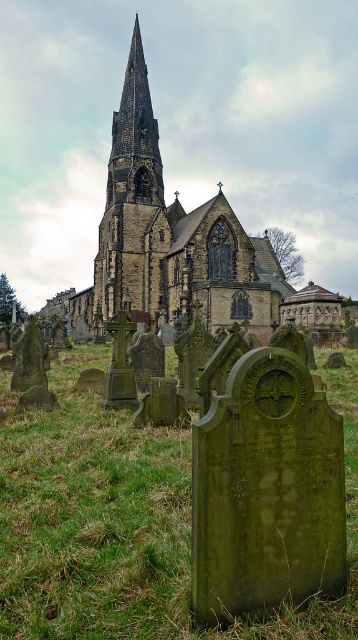
You are standing at the entrance of the dark stone church at center and want to visit a specific gravestone located in the front yard. The distance between you and the gravestone is 323.63 feet. If you walk at a pace of 3 feet per second, how many minutes will it take you to reach the gravestone?

The distance between you and the gravestone is 323.63 feet. At a walking pace of 3 feet per second, it would take 323.63 divided by 3 equals approximately 107.88 seconds. Converting seconds to minutes by dividing by 60 gives roughly 1.798 minutes, so approximately 1.8 minutes to reach the gravestone.

You are standing at the entrance of the cemetery and want to visit the green mossy gravestone at center. According to the coordinates provided, in which direction should you walk from the entrance to reach it?

The green mossy gravestone at center is located at coordinates point (x=126, y=522). Since the entrance is typically at the front, you should walk towards the center area of the cemetery to reach it.

You are standing in the cemetery and want to take a photo of the dark stone church at center. However, there is a green mossy gravestone at center blocking the view. Which direction should you move to get the church in your frame without the gravestone?

Move to the left side of the green mossy gravestone at center since it is on the right side of the dark stone church at center, so moving left would position the gravestone out of the frame while keeping the church centered.